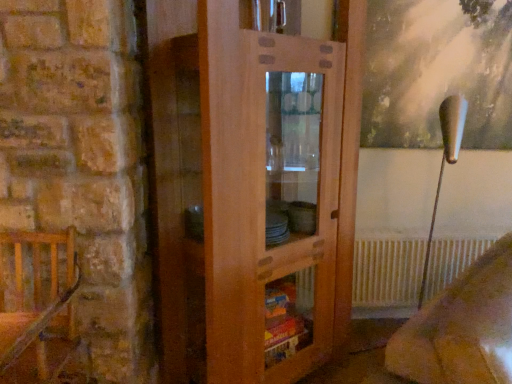
Question: Is wooden cabinet at center oriented towards white metallic radiator at lower right?

Choices:
 (A) yes
 (B) no

Answer: (B)

Question: Is wooden cabinet at center bigger than white metallic radiator at lower right?

Choices:
 (A) yes
 (B) no

Answer: (A)

Question: Is wooden cabinet at center oriented away from white metallic radiator at lower right?

Choices:
 (A) yes
 (B) no

Answer: (B)

Question: Is wooden cabinet at center not inside white metallic radiator at lower right?

Choices:
 (A) yes
 (B) no

Answer: (A)

Question: From a real-world perspective, is wooden cabinet at center positioned under white metallic radiator at lower right based on gravity?

Choices:
 (A) no
 (B) yes

Answer: (A)

Question: Visually, is wooden cabinet at center positioned to the left or to the right of white metallic radiator at lower right?

Choices:
 (A) right
 (B) left

Answer: (B)

Question: Is wooden cabinet at center spatially inside white metallic radiator at lower right, or outside of it?

Choices:
 (A) inside
 (B) outside

Answer: (B)

Question: From the image's perspective, is wooden cabinet at center above or below white metallic radiator at lower right?

Choices:
 (A) below
 (B) above

Answer: (B)

Question: Considering the positions of wooden cabinet at center and white metallic radiator at lower right in the image, is wooden cabinet at center taller or shorter than white metallic radiator at lower right?

Choices:
 (A) short
 (B) tall

Answer: (B)

Question: In terms of size, does wooden cabinet at center appear bigger or smaller than wooden chair at left?

Choices:
 (A) big
 (B) small

Answer: (A)

Question: Is wooden cabinet at center taller or shorter than wooden chair at left?

Choices:
 (A) short
 (B) tall

Answer: (B)

Question: From the image's perspective, is wooden cabinet at center located above or below wooden chair at left?

Choices:
 (A) below
 (B) above

Answer: (B)

Question: Visually, is wooden cabinet at center positioned to the left or to the right of wooden chair at left?

Choices:
 (A) right
 (B) left

Answer: (A)

Question: Is velvet beige armchair at lower right to the left or to the right of white metallic radiator at lower right in the image?

Choices:
 (A) left
 (B) right

Answer: (A)

Question: Which is correct: velvet beige armchair at lower right is inside white metallic radiator at lower right, or outside of it?

Choices:
 (A) outside
 (B) inside

Answer: (A)